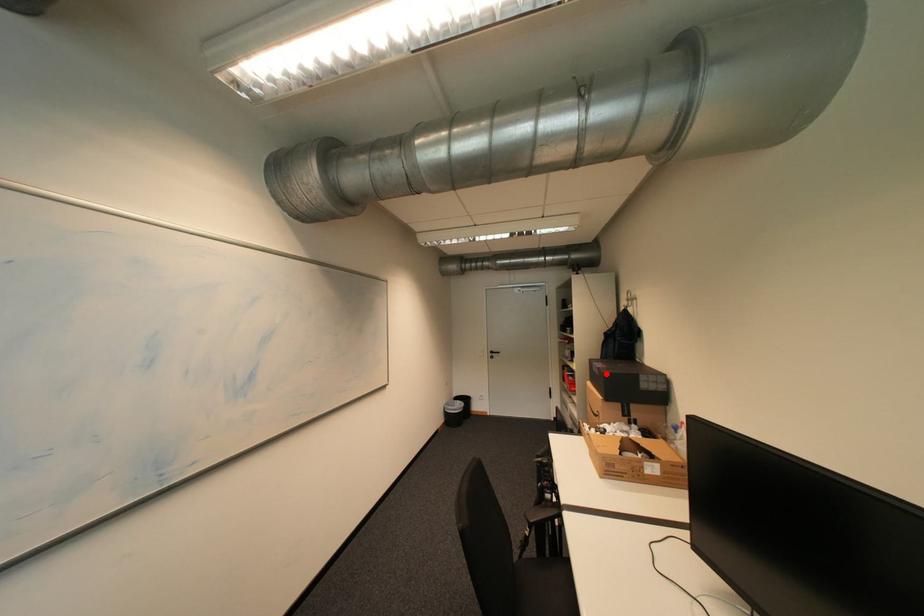
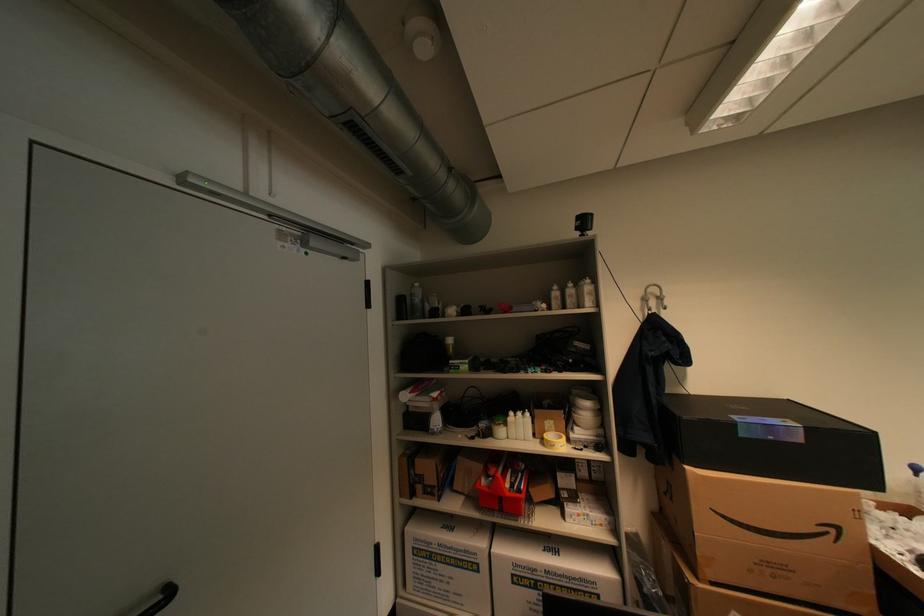
The point at the highlighted location is marked in the first image. Where is the corresponding point in the second image?

(808, 440)